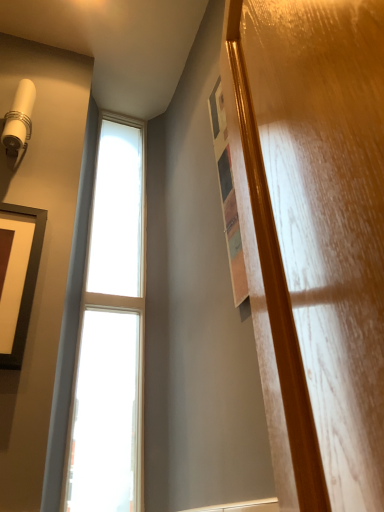
Question: Is matte black picture frame at left shorter than clear glass window at left?

Choices:
 (A) yes
 (B) no

Answer: (A)

Question: From a real-world perspective, does matte black picture frame at left sit lower than clear glass window at left?

Choices:
 (A) yes
 (B) no

Answer: (A)

Question: Considering the relative positions of matte black picture frame at left and clear glass window at left in the image provided, is matte black picture frame at left to the right of clear glass window at left from the viewer's perspective?

Choices:
 (A) no
 (B) yes

Answer: (A)

Question: Is matte black picture frame at left bigger than clear glass window at left?

Choices:
 (A) no
 (B) yes

Answer: (A)

Question: Can you confirm if matte black picture frame at left is positioned to the left of clear glass window at left?

Choices:
 (A) no
 (B) yes

Answer: (B)

Question: Can you confirm if matte black picture frame at left is wider than clear glass window at left?

Choices:
 (A) yes
 (B) no

Answer: (B)

Question: Is clear glass window at left not near matte black picture frame at left?

Choices:
 (A) no
 (B) yes

Answer: (A)

Question: Is matte black picture frame at left surrounded by clear glass window at left?

Choices:
 (A) no
 (B) yes

Answer: (A)

Question: Is clear glass window at left further to camera compared to matte black picture frame at left?

Choices:
 (A) no
 (B) yes

Answer: (B)

Question: Can you confirm if clear glass window at left is smaller than matte black picture frame at left?

Choices:
 (A) no
 (B) yes

Answer: (A)

Question: From the image's perspective, does clear glass window at left appear lower than matte black picture frame at left?

Choices:
 (A) no
 (B) yes

Answer: (A)

Question: Considering the relative positions of clear glass window at left and matte black picture frame at left in the image provided, is clear glass window at left to the left of matte black picture frame at left from the viewer's perspective?

Choices:
 (A) yes
 (B) no

Answer: (B)

Question: In terms of height, does matte black picture frame at left look taller or shorter compared to clear glass window at left?

Choices:
 (A) short
 (B) tall

Answer: (A)